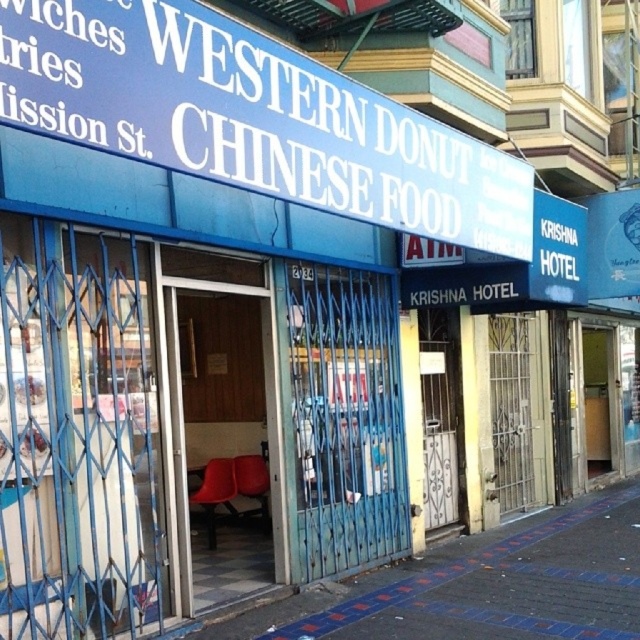
Question: Estimate the real-world distances between objects in this image. Which object is farther from the blue painted signboard at upper center?

Choices:
 (A) blue tiled pavement at lower center
 (B) matte red chairs at center

Answer: (B)

Question: Is the position of blue painted signboard at upper center less distant than that of blue tiled pavement at lower center?

Choices:
 (A) yes
 (B) no

Answer: (A)

Question: Estimate the real-world distances between objects in this image. Which object is farther from the blue painted signboard at upper center?

Choices:
 (A) matte red chairs at center
 (B) blue tiled pavement at lower center

Answer: (A)

Question: Among these points, which one is farthest from the camera?

Choices:
 (A) (333, 179)
 (B) (260, 545)

Answer: (B)

Question: Is blue painted signboard at upper center in front of matte red chairs at center?

Choices:
 (A) no
 (B) yes

Answer: (B)

Question: Is blue tiled pavement at lower center wider than matte red chairs at center?

Choices:
 (A) yes
 (B) no

Answer: (A)